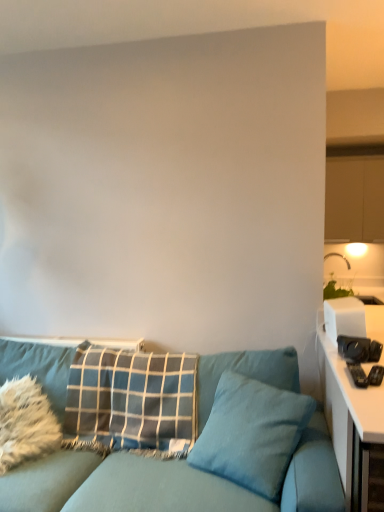
Question: In the image, is white glossy table at right on the left side or the right side of white fluffy pillow at lower left, acting as the 1th pillow starting from the left?

Choices:
 (A) right
 (B) left

Answer: (A)

Question: In terms of size, does white glossy table at right appear bigger or smaller than white fluffy pillow at lower left, acting as the 1th pillow starting from the left?

Choices:
 (A) big
 (B) small

Answer: (A)

Question: Which of these objects is positioned closest to the blue plaid pillow at center, the 2th pillow from the left?

Choices:
 (A) white plastic toaster at right
 (B) teal fabric pillow at center, arranged as the 1th pillow when viewed from the right
 (C) teal fabric couch at lower left
 (D) white fluffy pillow at lower left, marked as the third pillow in a right-to-left arrangement
 (E) white glossy table at right

Answer: (C)

Question: Estimate the real-world distances between objects in this image. Which object is closer to the white glossy table at right?

Choices:
 (A) teal fabric couch at lower left
 (B) blue plaid pillow at center, the second pillow when ordered from right to left
 (C) white fluffy pillow at lower left, marked as the third pillow in a right-to-left arrangement
 (D) teal fabric pillow at center, arranged as the 1th pillow when viewed from the right
 (E) white plastic toaster at right

Answer: (E)